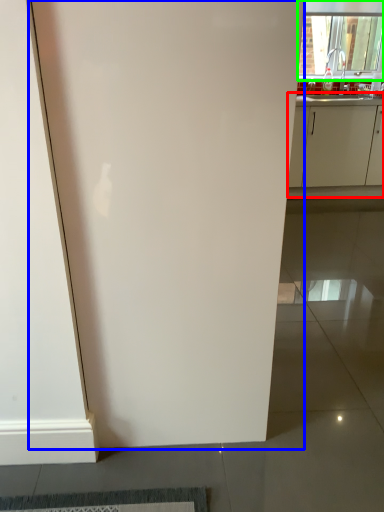
Question: Based on their relative distances, which object is nearer to cabinetry (highlighted by a red box)? Choose from door (highlighted by a blue box) and window (highlighted by a green box).

Choices:
 (A) door
 (B) window

Answer: (B)